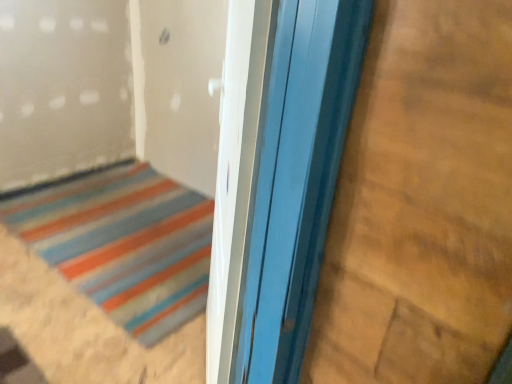
Question: Is smooth wood plywood at right situated inside wooden door at center or outside?

Choices:
 (A) inside
 (B) outside

Answer: (B)

Question: Does point (328, 334) appear closer or farther from the camera than point (20, 221)?

Choices:
 (A) farther
 (B) closer

Answer: (B)

Question: From the image's perspective, is smooth wood plywood at right above or below wooden door at center?

Choices:
 (A) above
 (B) below

Answer: (A)

Question: Would you say wooden door at center is to the left or to the right of smooth wood plywood at right in the picture?

Choices:
 (A) right
 (B) left

Answer: (B)

Question: Considering the positions of point (201, 278) and point (495, 109), is point (201, 278) closer or farther from the camera than point (495, 109)?

Choices:
 (A) farther
 (B) closer

Answer: (A)

Question: From their relative heights in the image, would you say wooden door at center is taller or shorter than smooth wood plywood at right?

Choices:
 (A) short
 (B) tall

Answer: (A)

Question: From the image's perspective, is wooden door at center above or below smooth wood plywood at right?

Choices:
 (A) above
 (B) below

Answer: (B)